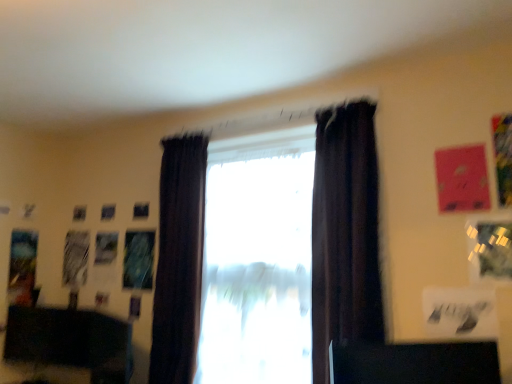
Question: Is dark fabric curtain at center, the 1th curtain when ordered from left to right, beside dark velvet curtain at center, which is counted as the second curtain, starting from the left?

Choices:
 (A) yes
 (B) no

Answer: (B)

Question: Is dark fabric curtain at center, marked as the 2th curtain in a front-to-back arrangement, aimed at dark velvet curtain at center, the first curtain positioned from the front?

Choices:
 (A) yes
 (B) no

Answer: (B)

Question: Considering the relative sizes of dark fabric curtain at center, the 1th curtain when ordered from left to right, and dark velvet curtain at center, arranged as the 1th curtain when viewed from the right, in the image provided, is dark fabric curtain at center, the 1th curtain when ordered from left to right, taller than dark velvet curtain at center, arranged as the 1th curtain when viewed from the right,?

Choices:
 (A) yes
 (B) no

Answer: (A)

Question: Considering the relative sizes of dark fabric curtain at center, the 1th curtain when ordered from left to right, and dark velvet curtain at center, arranged as the 1th curtain when viewed from the right, in the image provided, is dark fabric curtain at center, the 1th curtain when ordered from left to right, wider than dark velvet curtain at center, arranged as the 1th curtain when viewed from the right,?

Choices:
 (A) yes
 (B) no

Answer: (A)

Question: Is dark fabric curtain at center, acting as the first curtain starting from the back, completely or partially outside of dark velvet curtain at center, the second curtain from the back?

Choices:
 (A) yes
 (B) no

Answer: (A)

Question: Based on their positions, is satin dark curtains at center, marked as the 1th window in a left-to-right arrangement, located to the left or right of transparent glass window at center, acting as the first window starting from the right?

Choices:
 (A) right
 (B) left

Answer: (B)

Question: From a real-world perspective, is satin dark curtains at center, the 2th window from the right, above or below transparent glass window at center, which ranks as the 2th window in left-to-right order?

Choices:
 (A) below
 (B) above

Answer: (B)

Question: Is point (161, 314) closer or farther from the camera than point (271, 294)?

Choices:
 (A) closer
 (B) farther

Answer: (B)

Question: Is satin dark curtains at center, the 2th window from the right, taller or shorter than transparent glass window at center, which ranks as the 2th window in left-to-right order?

Choices:
 (A) tall
 (B) short

Answer: (A)

Question: Is satin dark curtains at center, marked as the 1th window in a left-to-right arrangement, wider or thinner than dark fabric curtain at center, the 1th curtain when ordered from left to right?

Choices:
 (A) thin
 (B) wide

Answer: (A)

Question: In terms of size, does satin dark curtains at center, marked as the 1th window in a left-to-right arrangement, appear bigger or smaller than dark fabric curtain at center, acting as the first curtain starting from the back?

Choices:
 (A) big
 (B) small

Answer: (B)

Question: In the image, is satin dark curtains at center, marked as the 1th window in a left-to-right arrangement, on the left side or the right side of dark fabric curtain at center, the 2th curtain from the right?

Choices:
 (A) right
 (B) left

Answer: (A)

Question: Does point (197, 173) appear closer or farther from the camera than point (168, 268)?

Choices:
 (A) farther
 (B) closer

Answer: (B)

Question: Is dark velvet curtain at center, arranged as the 1th curtain when viewed from the right, in front of or behind dark fabric curtain at center, the 1th curtain when ordered from left to right, in the image?

Choices:
 (A) behind
 (B) front

Answer: (B)

Question: From the image's perspective, is dark velvet curtain at center, arranged as the 1th curtain when viewed from the right, above or below dark fabric curtain at center, the 2th curtain from the right?

Choices:
 (A) below
 (B) above

Answer: (B)